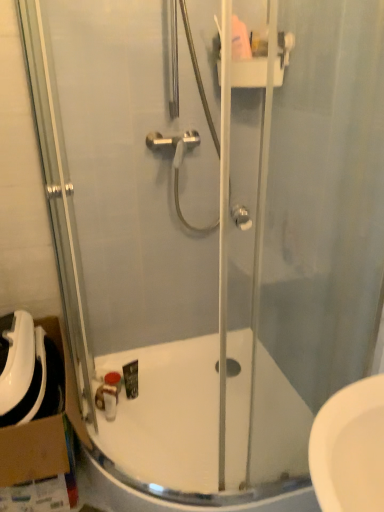
Question: Are white glossy bath at center and cardboard at left making contact?

Choices:
 (A) yes
 (B) no

Answer: (B)

Question: From a real-world perspective, is white glossy bath at center positioned under cardboard at left based on gravity?

Choices:
 (A) no
 (B) yes

Answer: (B)

Question: From a real-world perspective, is white glossy bath at center physically above cardboard at left?

Choices:
 (A) no
 (B) yes

Answer: (A)

Question: Considering the relative positions of white glossy bath at center and cardboard at left in the image provided, is white glossy bath at center to the right of cardboard at left from the viewer's perspective?

Choices:
 (A) yes
 (B) no

Answer: (A)

Question: Does white glossy bath at center lie in front of cardboard at left?

Choices:
 (A) yes
 (B) no

Answer: (A)

Question: Is point (115, 376) closer or farther from the camera than point (238, 352)?

Choices:
 (A) farther
 (B) closer

Answer: (A)

Question: In the image, is matte brown soap at lower center on the left side or the right side of white glossy bath at center?

Choices:
 (A) right
 (B) left

Answer: (B)

Question: From their relative heights in the image, would you say matte brown soap at lower center is taller or shorter than white glossy bath at center?

Choices:
 (A) short
 (B) tall

Answer: (A)

Question: Is matte brown soap at lower center inside or outside of white glossy bath at center?

Choices:
 (A) inside
 (B) outside

Answer: (A)

Question: Is point (109, 389) closer or farther from the camera than point (9, 444)?

Choices:
 (A) farther
 (B) closer

Answer: (A)

Question: Do you think matte brown soap at lower center is within cardboard at left, or outside of it?

Choices:
 (A) inside
 (B) outside

Answer: (B)

Question: Considering their positions, is matte brown soap at lower center located in front of or behind cardboard at left?

Choices:
 (A) behind
 (B) front

Answer: (A)

Question: From a real-world perspective, is matte brown soap at lower center positioned above or below cardboard at left?

Choices:
 (A) below
 (B) above

Answer: (A)

Question: From a real-world perspective, is white glossy bath at center physically located above or below cardboard at left?

Choices:
 (A) above
 (B) below

Answer: (B)

Question: Considering the relative positions of white glossy bath at center and cardboard at left in the image provided, is white glossy bath at center to the left or to the right of cardboard at left?

Choices:
 (A) left
 (B) right

Answer: (B)